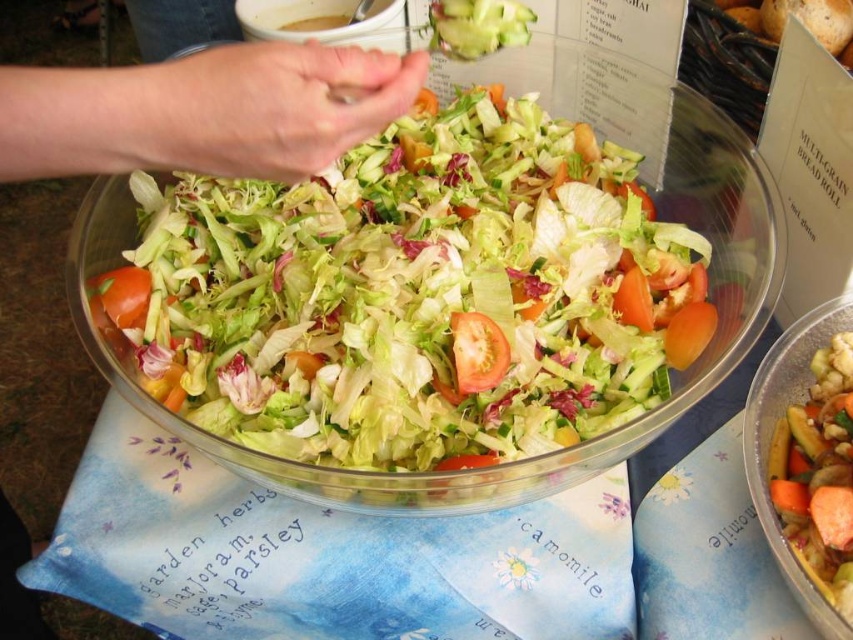
Consider the image. You are a chef preparing a salad and need to add dressing to the salad. The dressing bottle is on the counter behind the translucent plastic salad bowl at center. To pour the dressing into the bowl, should you move the red matte tomato at lower left out of the way first?

The translucent plastic salad bowl at center is located below the red matte tomato at lower left, so the tomato is above the bowl. To pour the dressing into the bowl, you need to move the red matte tomato at lower left out of the way first to avoid blocking the path.

You are a chef preparing a salad and want to add some dressing to the fresh green salad at center and the juicy red tomato at center. Which one is located to the left of the other?

The fresh green salad at center is positioned on the left side of the juicy red tomato at center, so it is located to the left of the juicy red tomato at center.